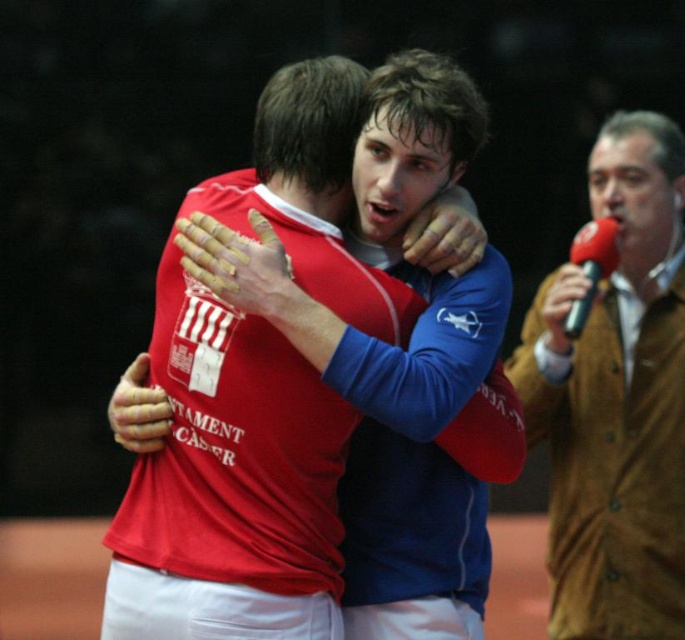
Can you confirm if matte red jersey at center is wider than black plastic microphone at right?

Yes, matte red jersey at center is wider than black plastic microphone at right.

Who is shorter, matte red jersey at center or black plastic microphone at right?

Standing shorter between the two is black plastic microphone at right.

Who is more forward, [340,216] or [603,262]?

Point [340,216] is more forward.

In order to click on matte red jersey at center in this screenshot , I will do `click(229, 484)`.

What do you see at coordinates (229, 484) in the screenshot?
I see `matte red jersey at center` at bounding box center [229, 484].

Looking at this image, does matte red jersey at center have a greater height compared to brown corduroy blazer at right?

Incorrect, matte red jersey at center's height is not larger of brown corduroy blazer at right's.

Find the location of `matte red jersey at center`. matte red jersey at center is located at coordinates (229, 484).

Locate an element on the screen. matte red jersey at center is located at coordinates (229, 484).

Does point (682, 579) come closer to viewer compared to point (588, 260)?

Yes, point (682, 579) is in front of point (588, 260).

Does brown corduroy blazer at right have a greater width compared to black plastic microphone at right?

Yes, brown corduroy blazer at right is wider than black plastic microphone at right.

Where is `brown corduroy blazer at right`? The width and height of the screenshot is (685, 640). brown corduroy blazer at right is located at coordinates (616, 400).